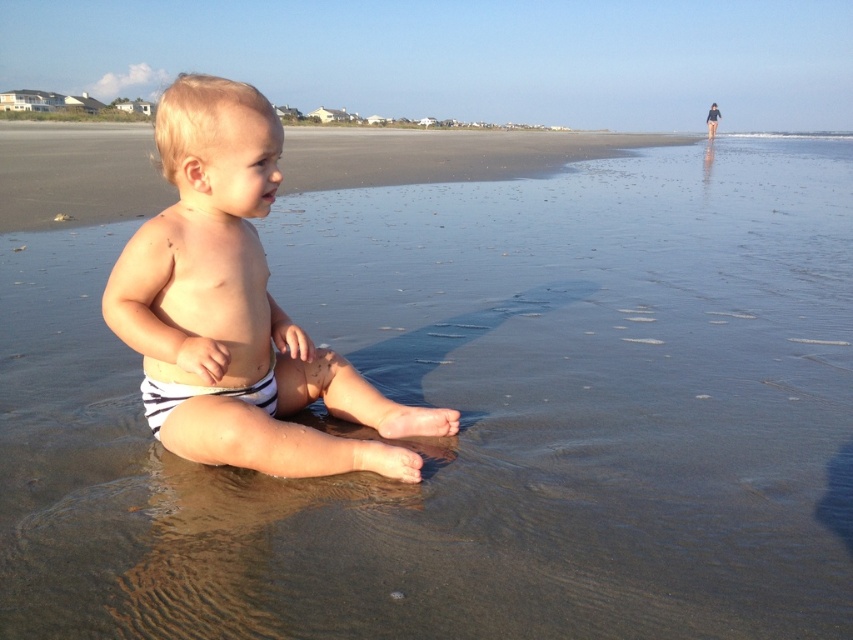
Question: Is striped fabric diaper at center to the right of white striped diaper at center from the viewer's perspective?

Choices:
 (A) no
 (B) yes

Answer: (B)

Question: Among these points, which one is nearest to the camera?

Choices:
 (A) (280, 413)
 (B) (270, 364)

Answer: (B)

Question: Which of the following is the closest to the observer?

Choices:
 (A) white striped diaper at center
 (B) striped fabric diaper at center

Answer: (B)

Question: Is striped fabric diaper at center wider than white striped diaper at center?

Choices:
 (A) yes
 (B) no

Answer: (A)

Question: Is striped fabric diaper at center closer to the viewer compared to white striped diaper at center?

Choices:
 (A) no
 (B) yes

Answer: (B)

Question: Which point is closer to the camera?

Choices:
 (A) (155, 385)
 (B) (212, 104)

Answer: (B)